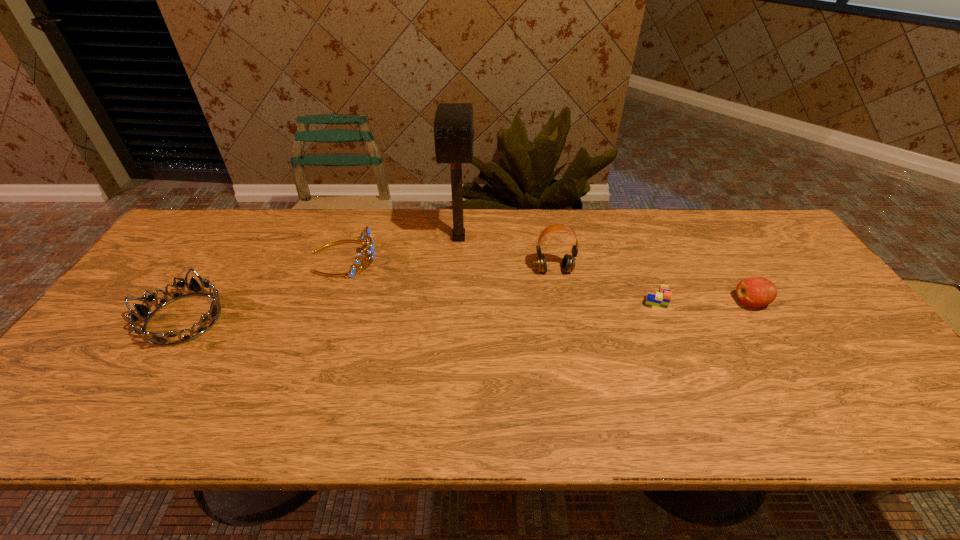
Identify the location of free space that satisfies the following two spatial constraints: 1. on the front-facing side of the farther tiara; 2. on the back side of the Lego. This screenshot has height=540, width=960. (329, 299).

Locate an element on the screen. vacant space that satisfies the following two spatial constraints: 1. on the ear cups of the fourth object from left to right; 2. on the left side of the fifth object from left to right is located at coordinates (560, 299).

Identify the location of free region that satisfies the following two spatial constraints: 1. on the ear cups of the fifth object from left to right; 2. on the left side of the headset. Image resolution: width=960 pixels, height=540 pixels. (560, 299).